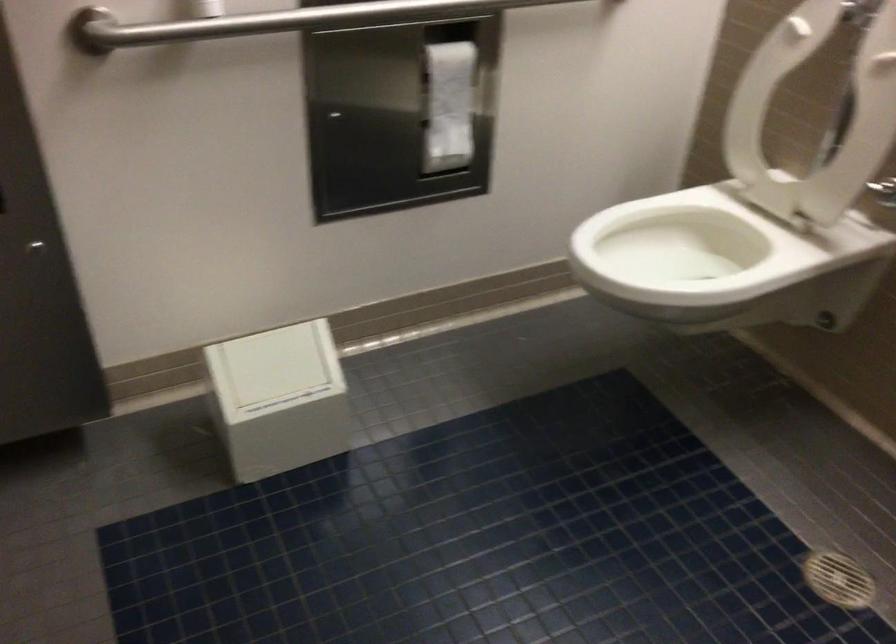
Describe the element at coordinates (824, 321) in the screenshot. This screenshot has width=896, height=644. I see `the toilet flush handle` at that location.